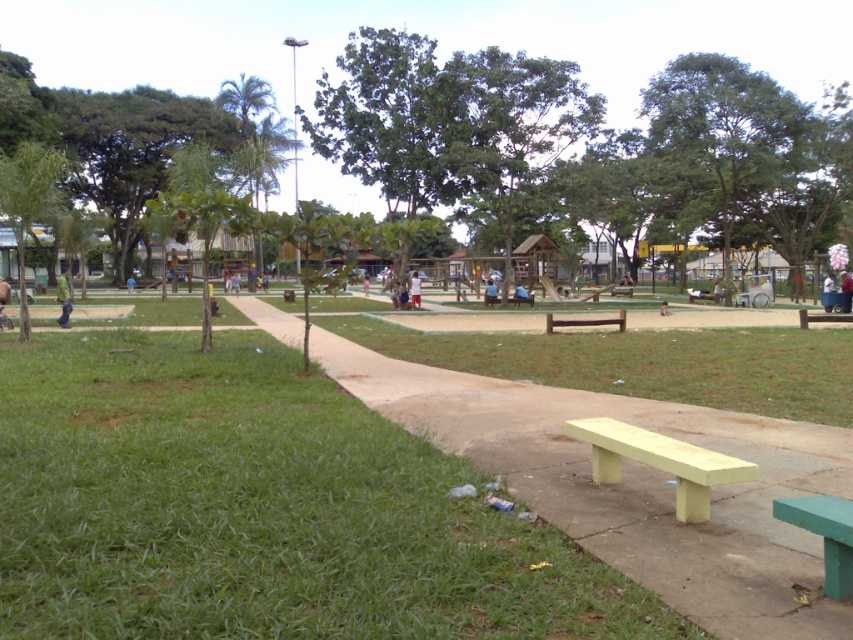
Which of these two, yellow wood bench at lower center or green leafy tree at left, stands shorter?

yellow wood bench at lower center is shorter.

Is point (718, 468) behind point (45, 177)?

No.

The image size is (853, 640). What are the coordinates of `yellow wood bench at lower center` in the screenshot? It's located at (660, 461).

Measure the distance between green leafy tree at upper left and camera.

15.23 meters

Who is lower down, green leafy tree at upper left or green leafy tree at upper right?

green leafy tree at upper right

Between point (103, 93) and point (706, 60), which one is positioned in front?

Point (706, 60)

Identify the location of green leafy tree at upper left. (120, 144).

Between yellow wood bench at lower center and yellow painted wood bench at lower right, which one has more height?

yellow painted wood bench at lower right is taller.

From the picture: Who is higher up, yellow wood bench at lower center or yellow painted wood bench at lower right?

yellow painted wood bench at lower right is above.

Identify the location of yellow wood bench at lower center. (660, 461).